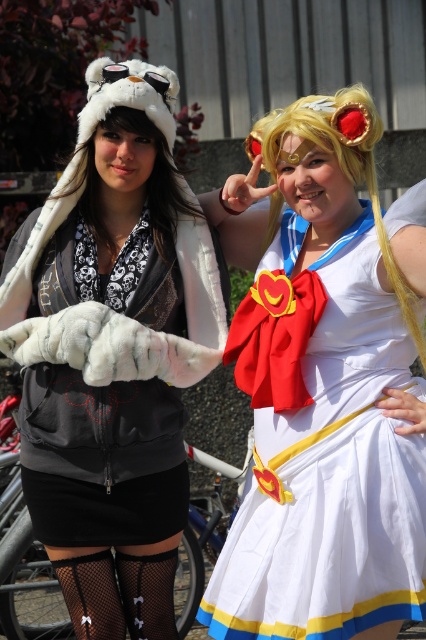
Question: Which of the following is the closest to the observer?

Choices:
 (A) (399, 611)
 (B) (85, 129)

Answer: (A)

Question: Is white fur hat at upper left in front of blonde hair at center?

Choices:
 (A) yes
 (B) no

Answer: (B)

Question: Which point is closer to the camera taking this photo?

Choices:
 (A) (242, 557)
 (B) (379, 138)
 (C) (138, 100)

Answer: (B)

Question: In this image, where is white fur hat at upper left located relative to white satin dress at center?

Choices:
 (A) left
 (B) right

Answer: (A)

Question: Does white fur hat at upper left have a smaller size compared to blonde hair at center?

Choices:
 (A) yes
 (B) no

Answer: (B)

Question: Among these points, which one is farthest from the camera?

Choices:
 (A) (100, 563)
 (B) (261, 118)
 (C) (284, 512)

Answer: (B)